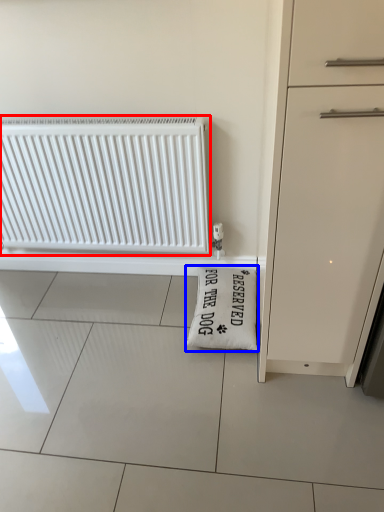
Question: Which of the following is the closest to the observer, radiator (highlighted by a red box) or doormat (highlighted by a blue box)?

Choices:
 (A) radiator
 (B) doormat

Answer: (A)